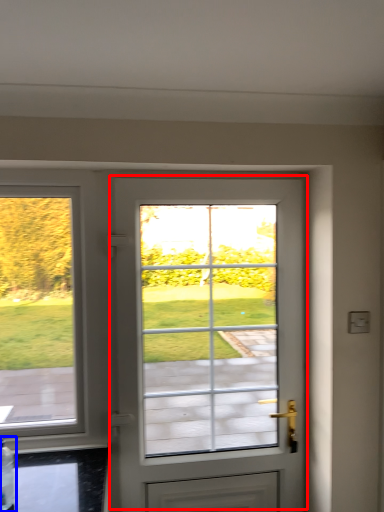
Question: Which object is further to the camera taking this photo, door (highlighted by a red box) or bottle (highlighted by a blue box)?

Choices:
 (A) door
 (B) bottle

Answer: (A)